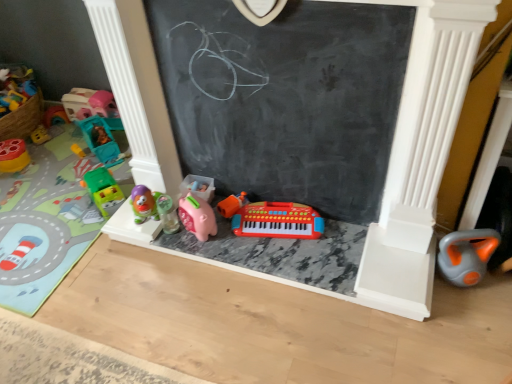
Question: Can you confirm if translucent plastic toy at center, the sixth toy in the left-to-right sequence, is bigger than translucent plastic toy car at left, positioned as the fifth toy in right-to-left order?

Choices:
 (A) yes
 (B) no

Answer: (B)

Question: Does translucent plastic toy at center, the sixth toy in the left-to-right sequence, come in front of translucent plastic toy car at left, positioned as the fifth toy in right-to-left order?

Choices:
 (A) yes
 (B) no

Answer: (A)

Question: From the image's perspective, is translucent plastic toy at center, the sixth toy in the left-to-right sequence, above translucent plastic toy car at left, positioned as the fifth toy in right-to-left order?

Choices:
 (A) no
 (B) yes

Answer: (A)

Question: Is translucent plastic toy at center, the sixth toy in the left-to-right sequence, thinner than translucent plastic toy car at left, positioned as the fifth toy in right-to-left order?

Choices:
 (A) no
 (B) yes

Answer: (B)

Question: Is translucent plastic toy at center, the sixth toy in the left-to-right sequence, turned away from translucent plastic toy car at left, positioned as the fifth toy in right-to-left order?

Choices:
 (A) no
 (B) yes

Answer: (A)

Question: Is translucent plastic toy at center, the sixth toy in the left-to-right sequence, at the left side of translucent plastic toy car at left, positioned as the fifth toy in right-to-left order?

Choices:
 (A) yes
 (B) no

Answer: (B)

Question: Does translucent plastic toy car at left, which is the fourth toy in left-to-right order, have a smaller size compared to orange rubber toy at lower right, arranged as the 1th toy when viewed from the right?

Choices:
 (A) yes
 (B) no

Answer: (B)

Question: Can you confirm if translucent plastic toy car at left, positioned as the fifth toy in right-to-left order, is bigger than orange rubber toy at lower right, the 8th toy in the left-to-right sequence?

Choices:
 (A) yes
 (B) no

Answer: (A)

Question: Is translucent plastic toy car at left, positioned as the fifth toy in right-to-left order, oriented away from orange rubber toy at lower right, the 8th toy in the left-to-right sequence?

Choices:
 (A) yes
 (B) no

Answer: (B)

Question: Would you say orange rubber toy at lower right, arranged as the 1th toy when viewed from the right, is part of translucent plastic toy car at left, which is the fourth toy in left-to-right order,'s contents?

Choices:
 (A) yes
 (B) no

Answer: (B)

Question: Does translucent plastic toy car at left, which is the fourth toy in left-to-right order, turn towards orange rubber toy at lower right, the 8th toy in the left-to-right sequence?

Choices:
 (A) yes
 (B) no

Answer: (B)

Question: Does translucent plastic toy car at left, positioned as the fifth toy in right-to-left order, come behind orange rubber toy at lower right, arranged as the 1th toy when viewed from the right?

Choices:
 (A) yes
 (B) no

Answer: (A)

Question: From the image's perspective, is green plastic toy car at left, positioned as the second toy in left-to-right order, on green plastic toy car at left, which is the 4th toy from right to left?

Choices:
 (A) yes
 (B) no

Answer: (A)